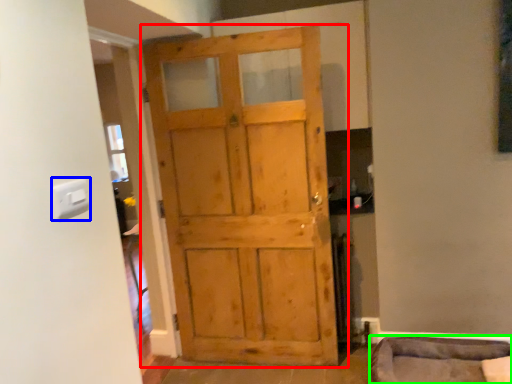
Question: Which is farther away from door (highlighted by a red box)? light switch (highlighted by a blue box) or furniture (highlighted by a green box)?

Choices:
 (A) light switch
 (B) furniture

Answer: (A)